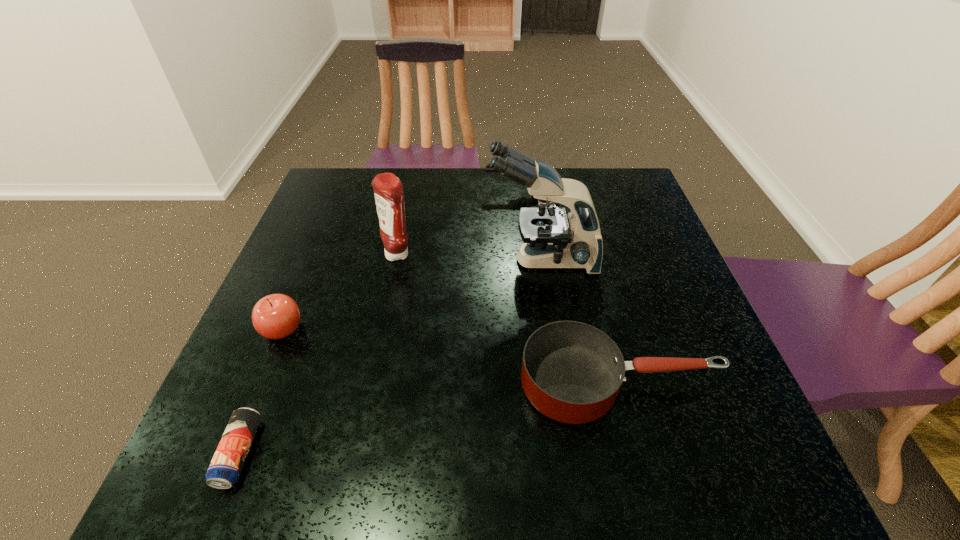
The width and height of the screenshot is (960, 540). I want to click on object present at the right edge, so click(x=571, y=372).

Identify the location of object that is positioned at the near left corner. (224, 470).

You are a GUI agent. You are given a task and a screenshot of the screen. Output one action in this format:
    pyautogui.click(x=<x>, y=<y>)
    Task: Click on the vacant space at the far edge of the desktop
    This screenshot has height=540, width=960.
    Given the screenshot: What is the action you would take?
    pyautogui.click(x=461, y=213)

You are a GUI agent. You are given a task and a screenshot of the screen. Output one action in this format:
    pyautogui.click(x=<x>, y=<y>)
    Task: Click on the free point at the left edge
    The width and height of the screenshot is (960, 540).
    Given the screenshot: What is the action you would take?
    pyautogui.click(x=317, y=373)

Locate an element on the screen. vacant area at the right edge is located at coordinates (628, 284).

I want to click on vacant point at the far left corner, so click(x=361, y=193).

I want to click on free space between the gun and the apple, so click(x=399, y=261).

I want to click on vacant region between the pan and the condiment, so click(509, 319).

The height and width of the screenshot is (540, 960). In order to click on free area in between the condiment and the apple in this screenshot , I will do `click(341, 292)`.

You are a GUI agent. You are given a task and a screenshot of the screen. Output one action in this format:
    pyautogui.click(x=<x>, y=<y>)
    Task: Click on the empty space between the shortest object and the second tallest object
    This screenshot has height=540, width=960.
    Given the screenshot: What is the action you would take?
    pyautogui.click(x=319, y=354)